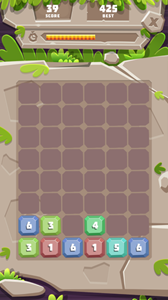
This screenshot has width=168, height=300. Find the location of `empty boxes`. empty boxes is located at coordinates (45, 200), (75, 229), (101, 199), (117, 175), (94, 116), (32, 164), (43, 96), (138, 136).